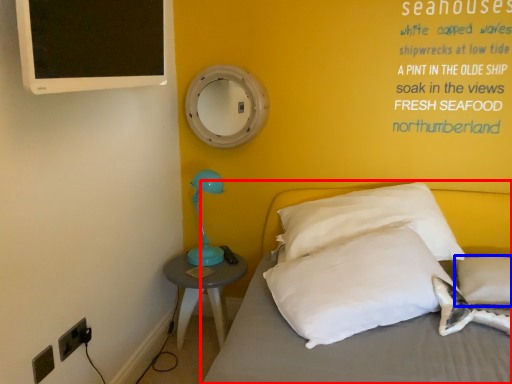
Question: Which point is further to the camera, bed (highlighted by a red box) or pillow (highlighted by a blue box)?

Choices:
 (A) bed
 (B) pillow

Answer: (B)